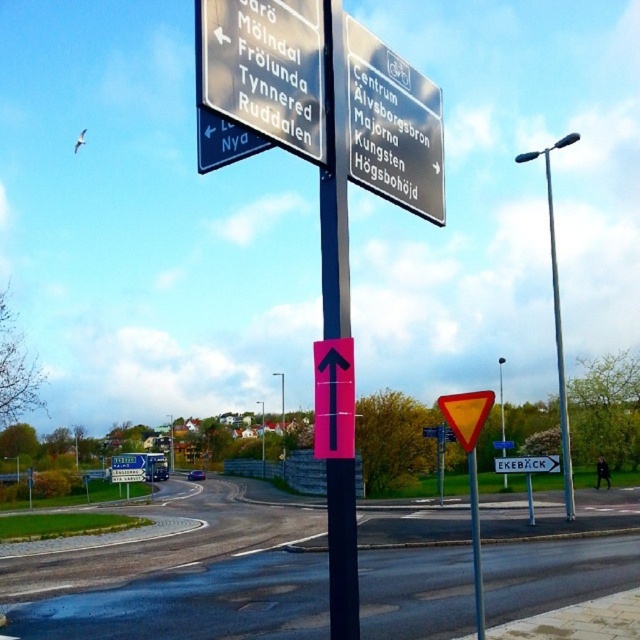
Between metallic silver sign at upper center and black plastic pole at center, which one is positioned higher?

metallic silver sign at upper center

Which is behind, point (440, 134) or point (328, 186)?

Positioned behind is point (440, 134).

Identify the location of metallic silver sign at upper center. (394, 125).